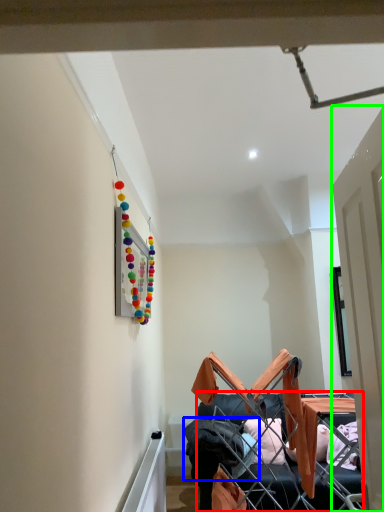
Question: Which object is the farthest from furniture (highlighted by a red box)? Choose among these: clothing (highlighted by a blue box) or door (highlighted by a green box).

Choices:
 (A) clothing
 (B) door

Answer: (B)